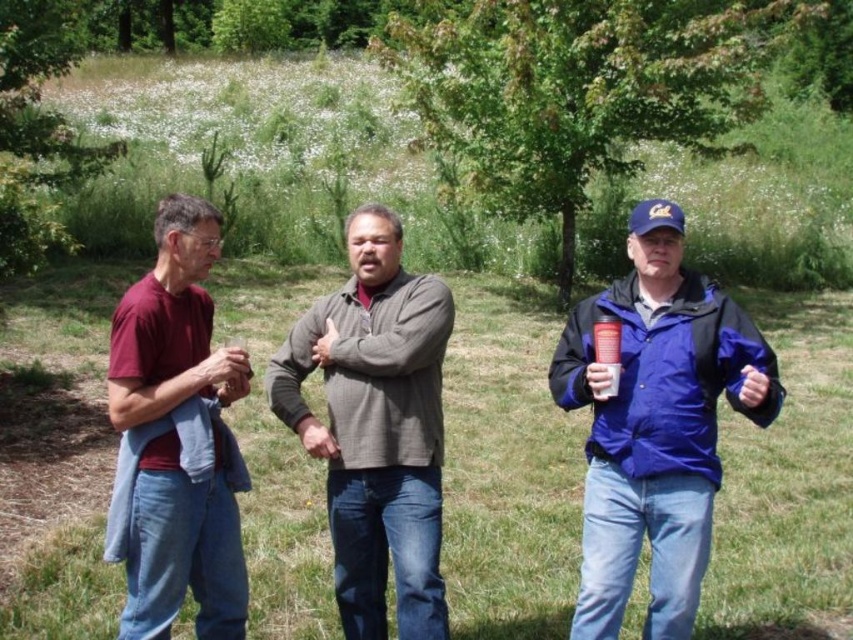
Question: Which object is closer to the camera taking this photo?

Choices:
 (A) gray sweater at center
 (B) blue matte jacket at right
 (C) maroon fabric shirt at left
 (D) metallic silver cup at right

Answer: (B)

Question: Can you confirm if maroon fabric shirt at left is smaller than metallic silver cup at right?

Choices:
 (A) no
 (B) yes

Answer: (A)

Question: Observing the image, what is the correct spatial positioning of blue matte jacket at right in reference to metallic silver cup at right?

Choices:
 (A) right
 (B) left

Answer: (A)

Question: Which object is positioned farthest from the blue matte jacket at right?

Choices:
 (A) metallic silver cup at right
 (B) gray sweater at center
 (C) maroon fabric shirt at left

Answer: (C)

Question: Is gray sweater at center positioned before maroon fabric shirt at left?

Choices:
 (A) no
 (B) yes

Answer: (A)

Question: Which point is closer to the camera?

Choices:
 (A) metallic silver cup at right
 (B) maroon fabric shirt at left

Answer: (B)